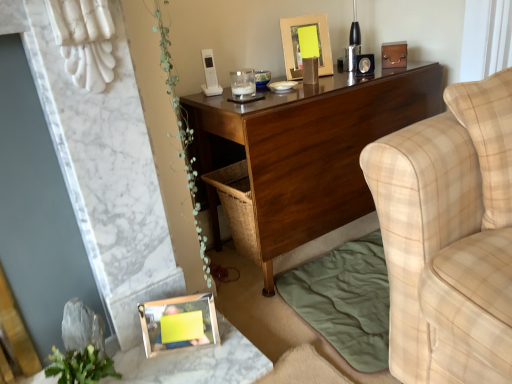
Question: Is dark wood desk at center facing towards green leafy plant at lower left?

Choices:
 (A) no
 (B) yes

Answer: (A)

Question: Does dark wood desk at center appear on the right side of green leafy plant at lower left?

Choices:
 (A) no
 (B) yes

Answer: (B)

Question: Could green leafy plant at lower left be considered to be inside dark wood desk at center?

Choices:
 (A) yes
 (B) no

Answer: (B)

Question: Would you say dark wood desk at center is a long distance from green leafy plant at lower left?

Choices:
 (A) no
 (B) yes

Answer: (A)

Question: Considering the relative sizes of dark wood desk at center and green leafy plant at lower left in the image provided, is dark wood desk at center taller than green leafy plant at lower left?

Choices:
 (A) yes
 (B) no

Answer: (A)

Question: Choose the correct answer: Is green leafy plant at lower left inside wooden frame at lower left or outside it?

Choices:
 (A) inside
 (B) outside

Answer: (B)

Question: Is green leafy plant at lower left taller or shorter than wooden frame at lower left?

Choices:
 (A) tall
 (B) short

Answer: (A)

Question: Considering the positions of point (78, 347) and point (161, 375), is point (78, 347) closer or farther from the camera than point (161, 375)?

Choices:
 (A) farther
 (B) closer

Answer: (B)

Question: In terms of width, does green leafy plant at lower left look wider or thinner when compared to wooden frame at lower left?

Choices:
 (A) thin
 (B) wide

Answer: (A)

Question: From their relative heights in the image, would you say gold metallic picture frame at upper center, which is counted as the first picture frame, starting from the back, is taller or shorter than green leafy plant at lower left?

Choices:
 (A) short
 (B) tall

Answer: (B)

Question: Is point (304, 39) closer or farther from the camera than point (86, 357)?

Choices:
 (A) closer
 (B) farther

Answer: (B)

Question: Considering the positions of gold metallic picture frame at upper center, the 2th picture frame from the bottom, and green leafy plant at lower left in the image, is gold metallic picture frame at upper center, the 2th picture frame from the bottom, wider or thinner than green leafy plant at lower left?

Choices:
 (A) thin
 (B) wide

Answer: (B)

Question: Choose the correct answer: Is gold metallic picture frame at upper center, which is counted as the first picture frame, starting from the back, inside green leafy plant at lower left or outside it?

Choices:
 (A) inside
 (B) outside

Answer: (B)

Question: Would you say wooden photo frame at lower left, placed as the 1th picture frame when sorted from bottom to top, is to the left or to the right of beige plaid fabric couch at right in the picture?

Choices:
 (A) right
 (B) left

Answer: (B)

Question: Considering the positions of point (177, 299) and point (390, 322), is point (177, 299) closer or farther from the camera than point (390, 322)?

Choices:
 (A) farther
 (B) closer

Answer: (A)